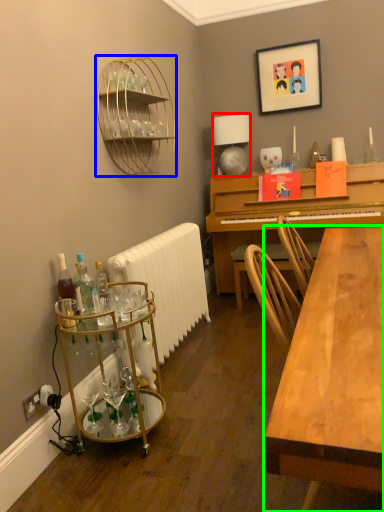
Question: Estimate the real-world distances between objects in this image. Which object is farther from lamp (highlighted by a red box), shelf (highlighted by a blue box) or desk (highlighted by a green box)?

Choices:
 (A) shelf
 (B) desk

Answer: (B)